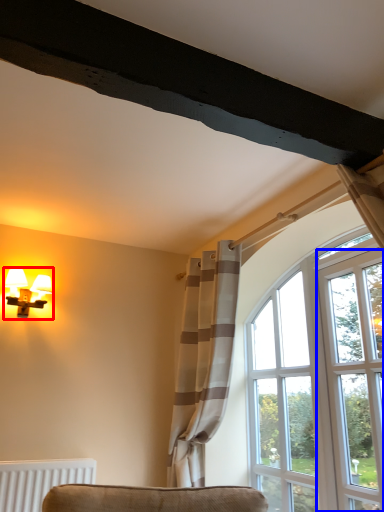
Question: Which object appears closest to the camera in this image, lamp (highlighted by a red box) or screen door (highlighted by a blue box)?

Choices:
 (A) lamp
 (B) screen door

Answer: (B)